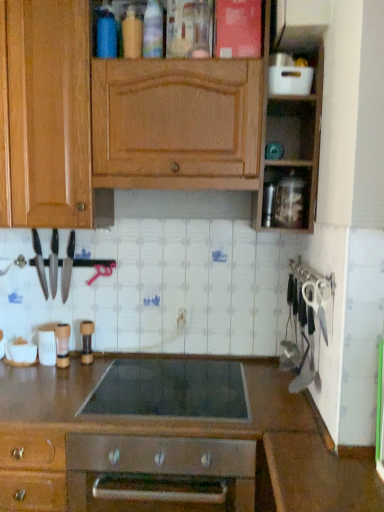
You are a GUI agent. You are given a task and a screenshot of the screen. Output one action in this format:
    pyautogui.click(x=<x>, y=<y>)
    Task: Click on the free point to the left of brown matte pepper grinder at center, which appears as the fourth appliance when viewed from the left
    The height and width of the screenshot is (512, 384).
    Given the screenshot: What is the action you would take?
    pyautogui.click(x=56, y=366)